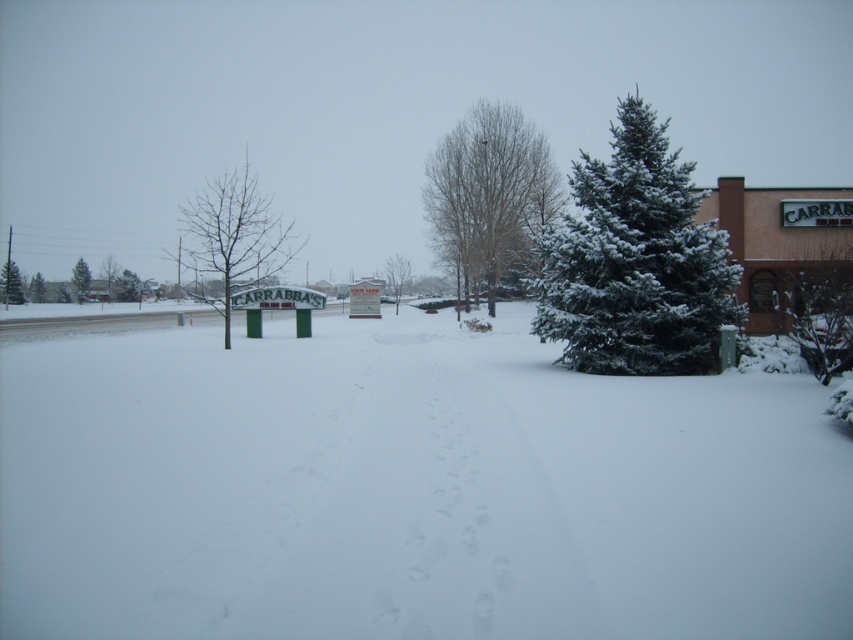
Question: Does bare wood tree at left appear on the right side of green textured tree at center?

Choices:
 (A) yes
 (B) no

Answer: (A)

Question: Which is nearer to the green plastic sign at center?

Choices:
 (A) green textured tree at center
 (B) bare wood tree at center

Answer: (B)

Question: Is bare wood tree at left positioned behind green textured evergreen at left?

Choices:
 (A) no
 (B) yes

Answer: (A)

Question: Which of the following is the farthest from the observer?

Choices:
 (A) (41, 292)
 (B) (500, 104)
 (C) (563, 332)
 (D) (138, 282)

Answer: (B)

Question: Can you confirm if green plastic sign at center is smaller than green snow-covered tree at left?

Choices:
 (A) no
 (B) yes

Answer: (B)

Question: Among these points, which one is farthest from the camera?

Choices:
 (A) (112, 269)
 (B) (524, 128)
 (C) (614, 362)

Answer: (A)